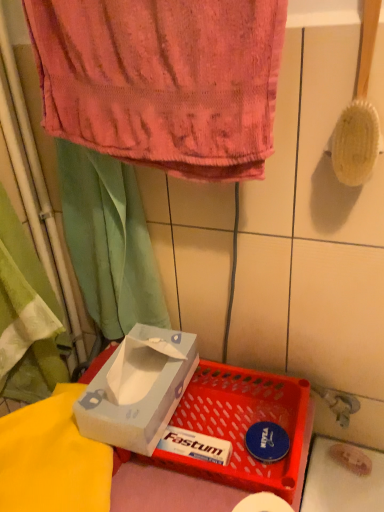
Question: Is translucent plastic tray at lower center positioned with its back to pink terry cloth towel at upper center?

Choices:
 (A) no
 (B) yes

Answer: (A)

Question: Considering the relative sizes of translucent plastic tray at lower center and pink terry cloth towel at upper center in the image provided, is translucent plastic tray at lower center thinner than pink terry cloth towel at upper center?

Choices:
 (A) no
 (B) yes

Answer: (A)

Question: Is translucent plastic tray at lower center to the right of pink terry cloth towel at upper center from the viewer's perspective?

Choices:
 (A) no
 (B) yes

Answer: (B)

Question: Is translucent plastic tray at lower center positioned before pink terry cloth towel at upper center?

Choices:
 (A) no
 (B) yes

Answer: (A)

Question: Is translucent plastic tray at lower center not close to pink terry cloth towel at upper center?

Choices:
 (A) no
 (B) yes

Answer: (A)

Question: From a real-world perspective, is translucent plastic tray at lower center beneath pink terry cloth towel at upper center?

Choices:
 (A) yes
 (B) no

Answer: (A)

Question: Is green fabric curtain at upper left not inside translucent plastic tray at lower center?

Choices:
 (A) no
 (B) yes

Answer: (B)

Question: Does green fabric curtain at upper left appear on the left side of translucent plastic tray at lower center?

Choices:
 (A) yes
 (B) no

Answer: (A)

Question: Is green fabric curtain at upper left directly adjacent to translucent plastic tray at lower center?

Choices:
 (A) no
 (B) yes

Answer: (A)

Question: Is green fabric curtain at upper left oriented towards translucent plastic tray at lower center?

Choices:
 (A) yes
 (B) no

Answer: (B)

Question: From the image's perspective, is green fabric curtain at upper left located beneath translucent plastic tray at lower center?

Choices:
 (A) yes
 (B) no

Answer: (B)

Question: Considering the relative sizes of green fabric curtain at upper left and translucent plastic tray at lower center in the image provided, is green fabric curtain at upper left smaller than translucent plastic tray at lower center?

Choices:
 (A) no
 (B) yes

Answer: (A)

Question: Considering the relative sizes of pink terry cloth towel at upper center and green fabric curtain at upper left in the image provided, is pink terry cloth towel at upper center taller than green fabric curtain at upper left?

Choices:
 (A) yes
 (B) no

Answer: (B)